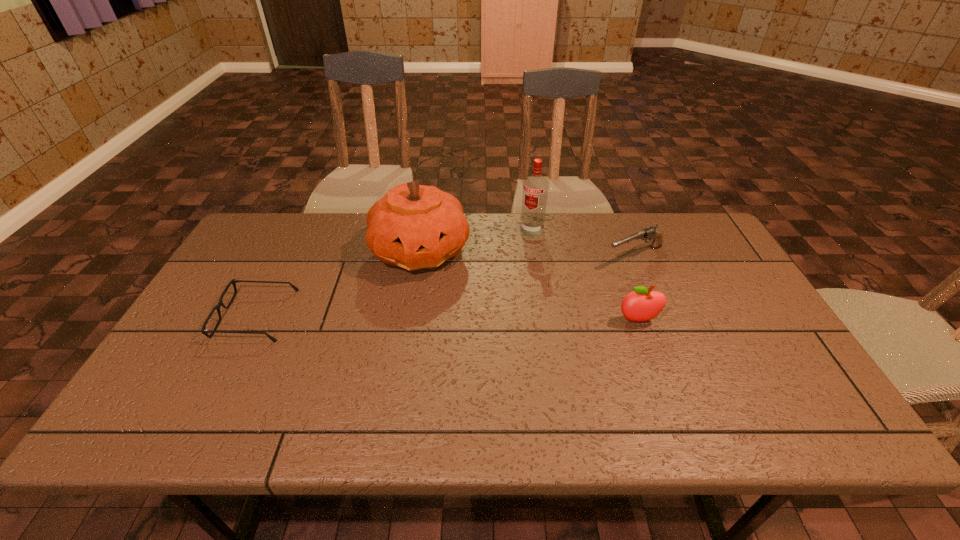
In order to click on the leftmost object in this screenshot , I will do click(x=233, y=281).

Where is `the shortest object`? The image size is (960, 540). the shortest object is located at coordinates (233, 281).

Find the location of a particular element. apple is located at coordinates pyautogui.click(x=644, y=304).

Locate an element on the screen. This screenshot has width=960, height=540. gun is located at coordinates (650, 233).

Find the location of `pumpkin`. pumpkin is located at coordinates (413, 226).

This screenshot has height=540, width=960. In order to click on the third object from left to right in this screenshot , I will do `click(535, 187)`.

This screenshot has width=960, height=540. Find the location of `vacant point located on the front-facing side of the shortest object`. vacant point located on the front-facing side of the shortest object is located at coordinates (197, 315).

You are a GUI agent. You are given a task and a screenshot of the screen. Output one action in this format:
    pyautogui.click(x=<x>, y=<y>)
    Task: Click on the free region located 0.180m on the front-facing side of the apple
    
    Given the screenshot: What is the action you would take?
    pyautogui.click(x=661, y=386)

This screenshot has width=960, height=540. I want to click on vacant space situated 0.050m aiming along the barrel of the fourth tallest object, so click(x=596, y=268).

Where is `vacant area situated 0.320m aiming along the barrel of the fourth tallest object`? The image size is (960, 540). vacant area situated 0.320m aiming along the barrel of the fourth tallest object is located at coordinates (522, 301).